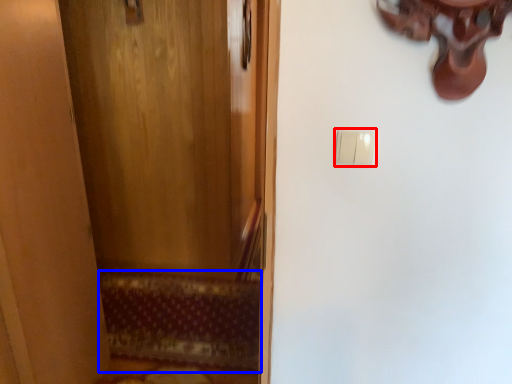
Question: Which object appears farthest to the camera in this image, light switch (highlighted by a red box) or doormat (highlighted by a blue box)?

Choices:
 (A) light switch
 (B) doormat

Answer: (B)